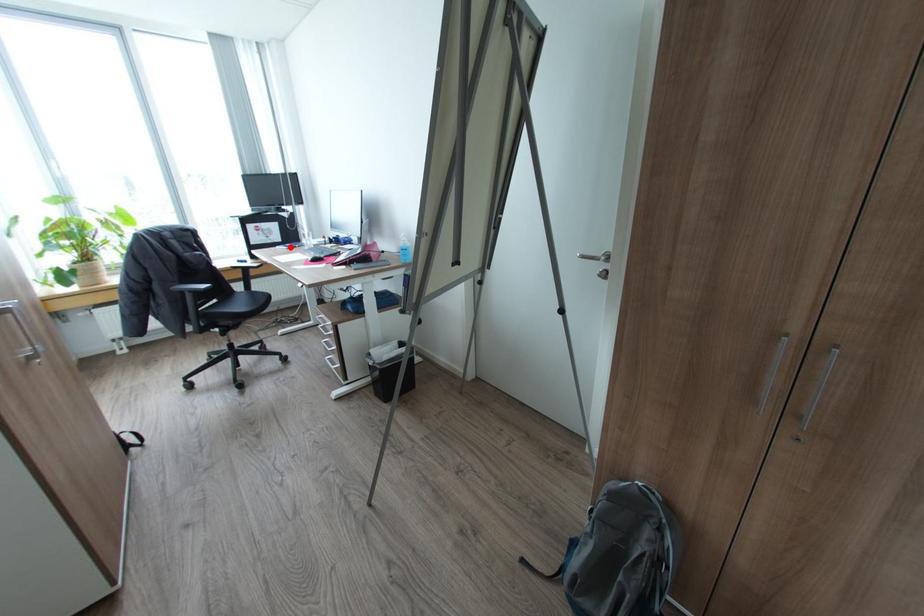
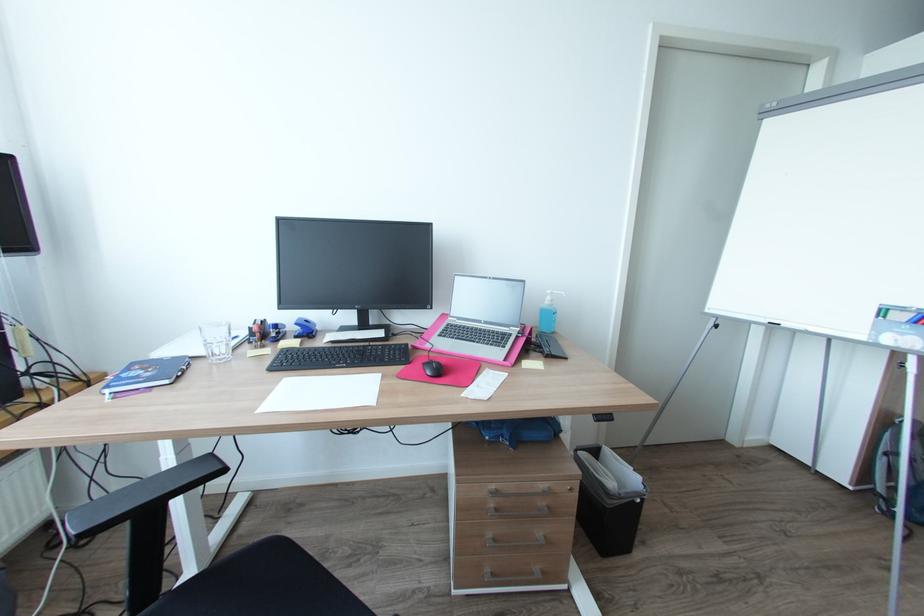
The point at the highlighted location is marked in the first image. Where is the corresponding point in the second image?

(171, 381)